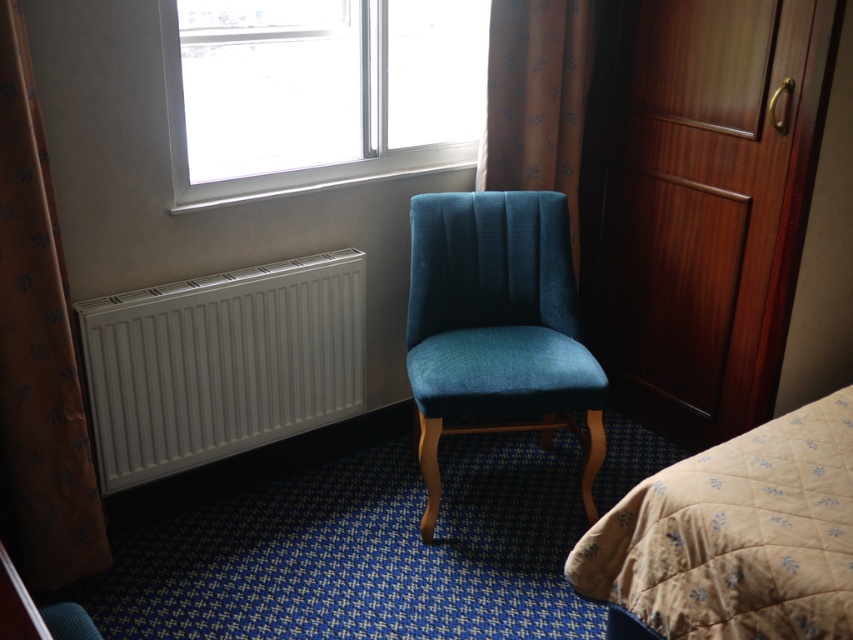
You are standing in the room and want to move from the white matte radiator at lower left to the teal fabric chair at center. Which direction should you move to reach the chair?

The white matte radiator at lower left is to the left of the teal fabric chair at center, so you should move to the right to reach the chair.